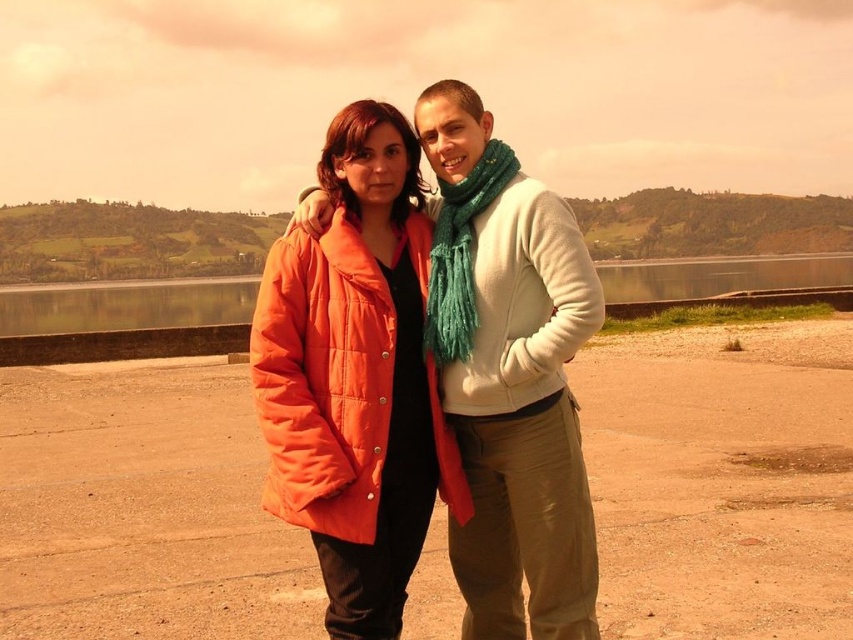
Is orange puffy coat at center to the right of quilted orange jacket at center from the viewer's perspective?

No, orange puffy coat at center is not to the right of quilted orange jacket at center.

Locate an element on the screen. The width and height of the screenshot is (853, 640). orange puffy coat at center is located at coordinates (355, 378).

Who is positioned more to the right, quilted orange jacket at center or transparent glass water at lower left?

quilted orange jacket at center is more to the right.

Can you confirm if quilted orange jacket at center is smaller than transparent glass water at lower left?

Indeed, quilted orange jacket at center has a smaller size compared to transparent glass water at lower left.

The width and height of the screenshot is (853, 640). Find the location of `quilted orange jacket at center`. quilted orange jacket at center is located at coordinates (509, 374).

At what (x,y) coordinates should I click in order to perform the action: click on quilted orange jacket at center. Please return your answer as a coordinate pair (x, y). The height and width of the screenshot is (640, 853). Looking at the image, I should click on (509, 374).

Which is below, orange puffy coat at center or transparent glass water at lower left?

orange puffy coat at center is lower down.

Does orange puffy coat at center have a lesser width compared to transparent glass water at lower left?

Yes, orange puffy coat at center is thinner than transparent glass water at lower left.

Which is behind, point (283, 324) or point (114, 289)?

The point (114, 289) is behind.

At what (x,y) coordinates should I click in order to perform the action: click on orange puffy coat at center. Please return your answer as a coordinate pair (x, y). This screenshot has width=853, height=640. Looking at the image, I should click on (355, 378).